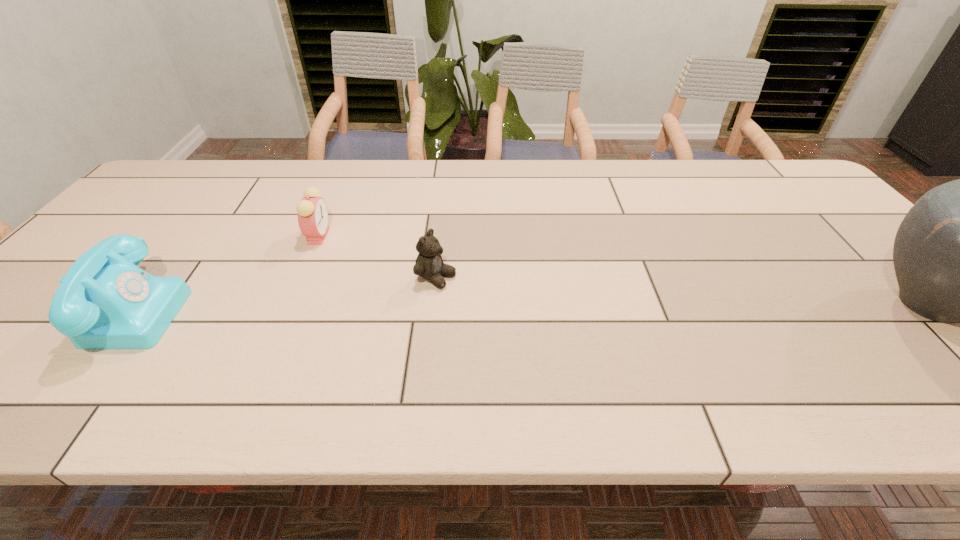
Find the location of `vacant space on the desktop that is between the telephone and the urn and is positioned on the face of the alarm clock`. vacant space on the desktop that is between the telephone and the urn and is positioned on the face of the alarm clock is located at coordinates (426, 307).

Image resolution: width=960 pixels, height=540 pixels. What are the coordinates of `vacant space on the desktop that is between the third shortest object and the rightmost object and is positioned on the face of the teddy bear` in the screenshot? It's located at (513, 307).